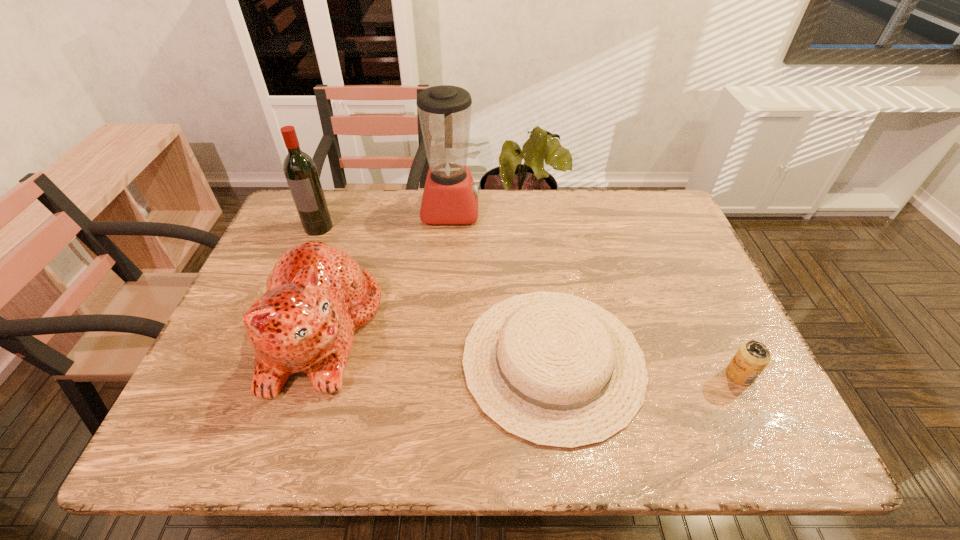
The height and width of the screenshot is (540, 960). What are the coordinates of `free space at the right edge of the desktop` in the screenshot? It's located at (682, 308).

At what (x,y) coordinates should I click in order to perform the action: click on vacant space at the far left corner of the desktop. Please return your answer as a coordinate pair (x, y). This screenshot has height=540, width=960. Looking at the image, I should click on (338, 197).

This screenshot has height=540, width=960. What are the coordinates of `vacant point at the near left corner` in the screenshot? It's located at (242, 425).

Identify the location of unoccupied area between the third tallest object and the sunhat. (437, 346).

Find the location of a particular element. free point between the sunhat and the wine bottle is located at coordinates (436, 294).

The width and height of the screenshot is (960, 540). Find the location of `free point between the blender and the sunhat`. free point between the blender and the sunhat is located at coordinates (502, 285).

This screenshot has width=960, height=540. I want to click on free space between the wine bottle and the shortest object, so click(x=436, y=294).

Find the location of `free space between the tallest object and the fourth shortest object`. free space between the tallest object and the fourth shortest object is located at coordinates (385, 219).

This screenshot has width=960, height=540. I want to click on free space that is in between the sunhat and the rightmost object, so click(646, 368).

The width and height of the screenshot is (960, 540). Identify the location of empty space between the shortest object and the beer can. (646, 368).